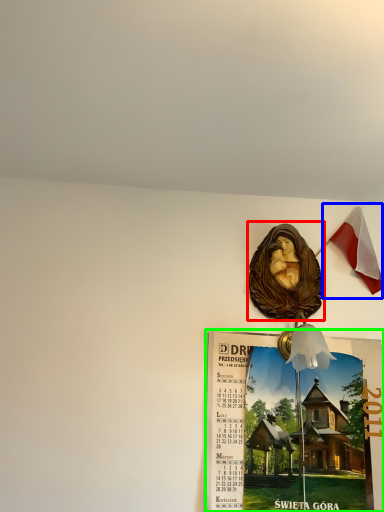
Question: Which object is positioned closest to art (highlighted by a red box)? Select from national flag (highlighted by a blue box) and poster page (highlighted by a green box).

Choices:
 (A) national flag
 (B) poster page

Answer: (A)